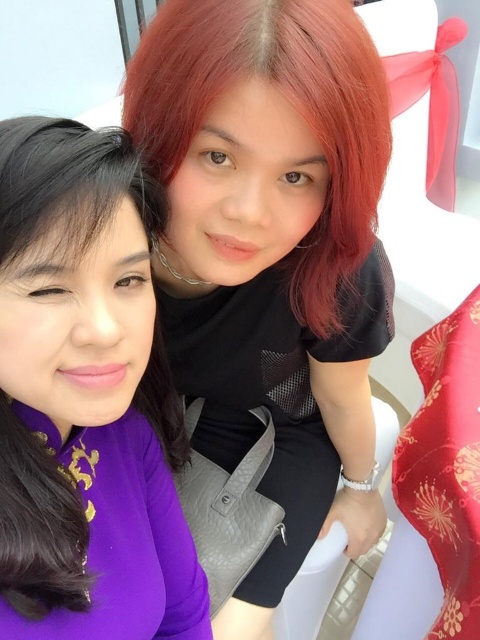
Is point (91, 307) closer to camera compared to point (334, 60)?

Yes.

Who is more distant from viewer, (52, 141) or (291, 8)?

Positioned behind is point (291, 8).

The width and height of the screenshot is (480, 640). Find the location of `matte black hair at upper right`. matte black hair at upper right is located at coordinates (84, 400).